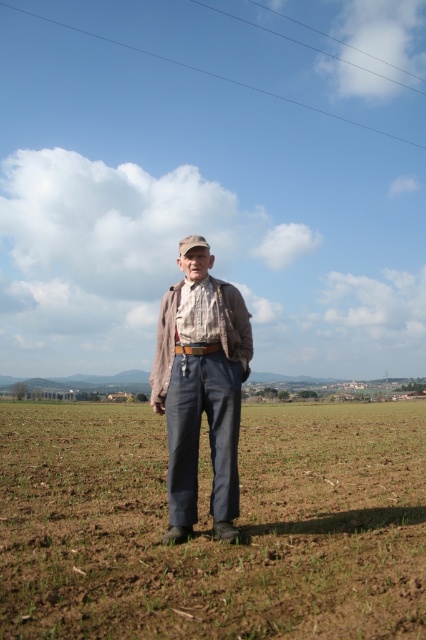
The dull gray fabric at center is located at which coordinate point?

The dull gray fabric at center is located at coordinate point (210, 524).

You are an observer looking at the elderly man in the field. Which fabric is nearer to you, the dull gray fabric at center or the plaid fabric shirt at center?

The dull gray fabric at center is closer to the viewer than the plaid fabric shirt at center.